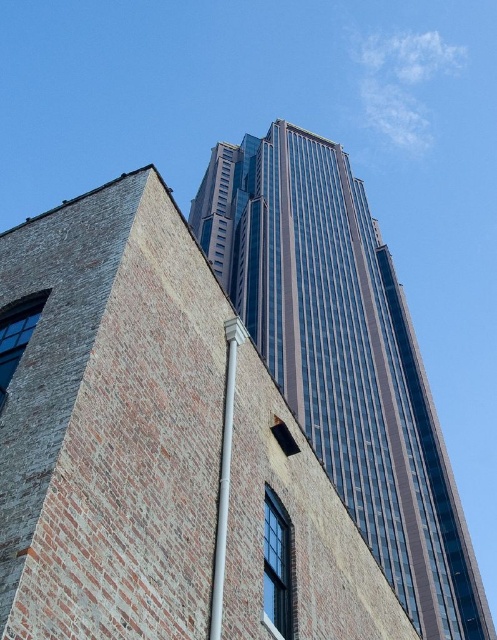
You are an architect analyzing the image. Which object is taller between the glassy reflective skyscraper at center and the white plastic pipe at center?

The glassy reflective skyscraper at center is much taller than the white plastic pipe at center.

You are an architect analyzing the spatial relationship between the glassy reflective skyscraper at center and the white plastic pipe at center. Which object is positioned higher in the image?

The glassy reflective skyscraper at center is located above the white plastic pipe at center, so it is positioned higher in the image.

You are a photographer positioned in the middle of the street between the two buildings. You want to capture a photo where the white plastic pipe at center is visible to the left of the glassy reflective skyscraper at center. Based on the scene description, will your desired composition be possible?

Yes, the desired composition is possible because the glassy reflective skyscraper at center is to the right of the white plastic pipe at center, meaning the pipe will naturally appear to the left of the skyscraper in the photo.